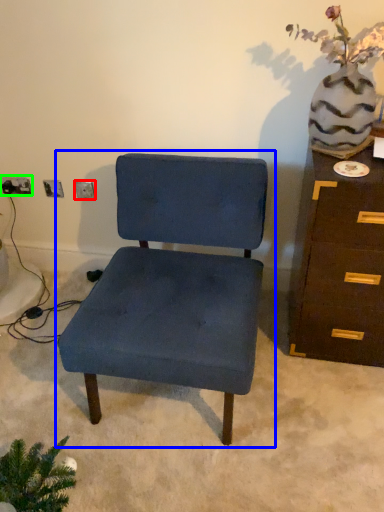
Question: Considering the real-world distances, which object is farthest from electric outlet (highlighted by a red box)? chair (highlighted by a blue box) or electric outlet (highlighted by a green box)?

Choices:
 (A) chair
 (B) electric outlet

Answer: (A)